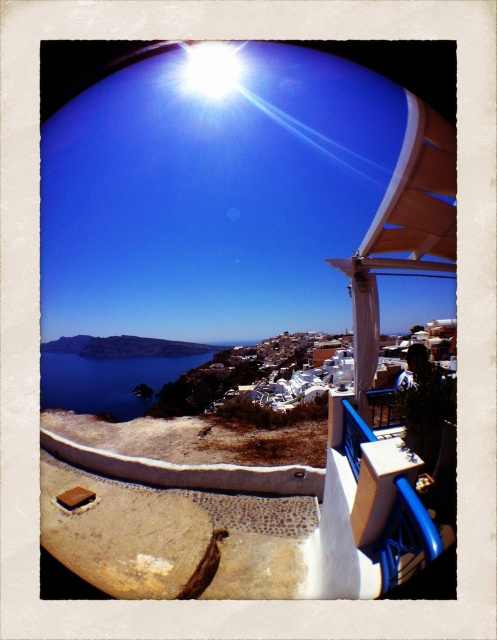
You are standing on the balcony and want to place a small potted plant on the white matte terrace at upper center. To ensure it doesn not fall off, where exactly should you position it relative to the terrace?

The white matte terrace at upper center is located at coordinates point (210, 292), so placing the potted plant near the center of the terrace at those coordinates will help prevent it from falling off.

You are standing on the balcony and want to place two markers at the coordinates point (x=161, y=291) and point (x=161, y=371). Which marker will be closer to you when placed?

Point (x=161, y=291) is closer to the viewer than point (x=161, y=371), so the marker at point (x=161, y=291) will be closer to you.